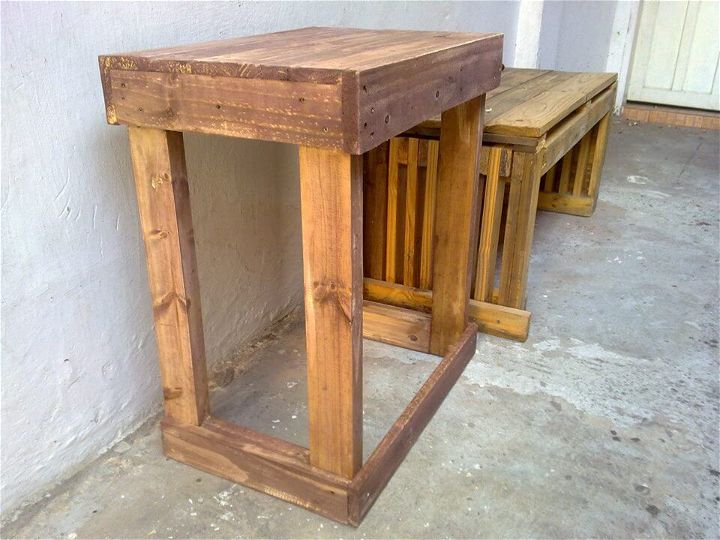
Where is `white wall`? Image resolution: width=720 pixels, height=540 pixels. white wall is located at coordinates (487, 6).